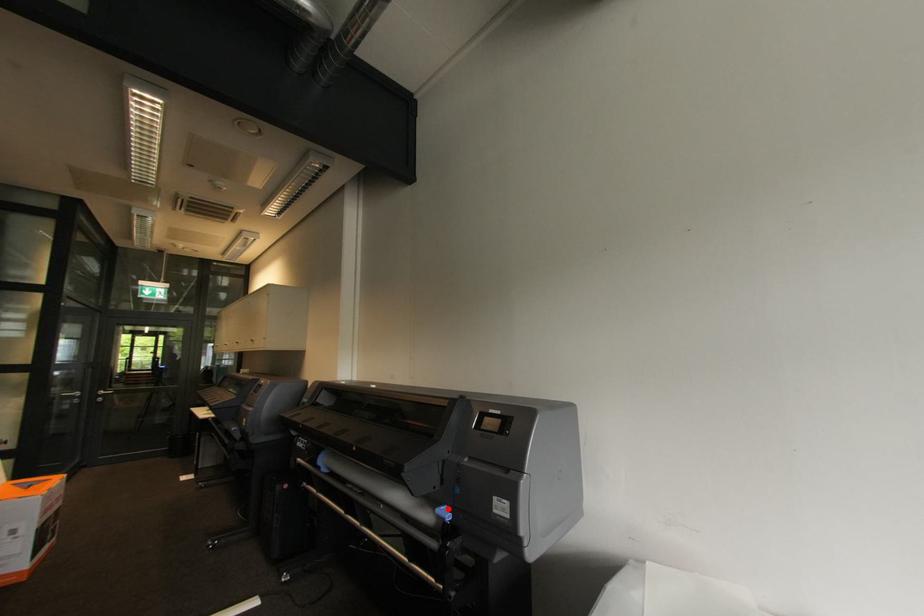
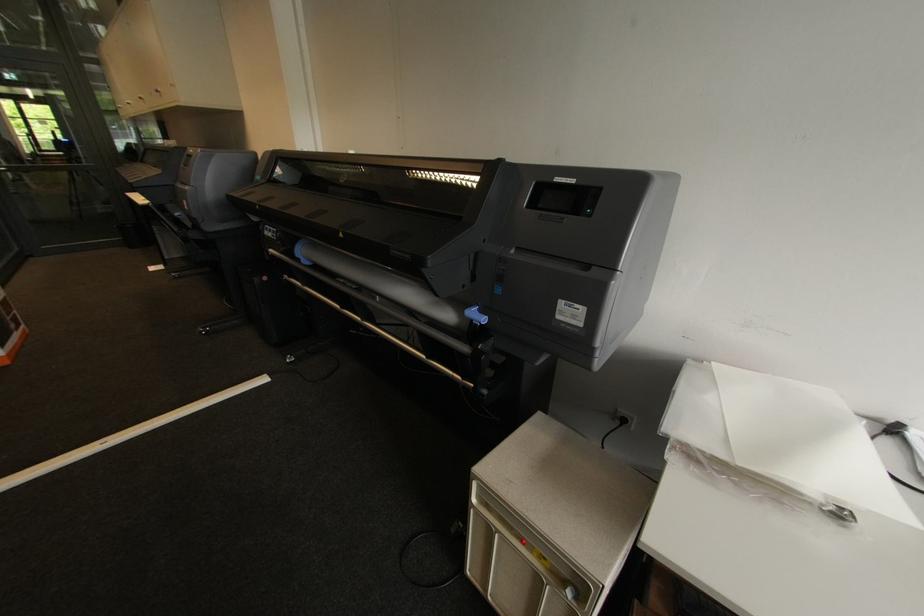
The point at the highlighted location is marked in the first image. Where is the corresponding point in the second image?

(479, 310)